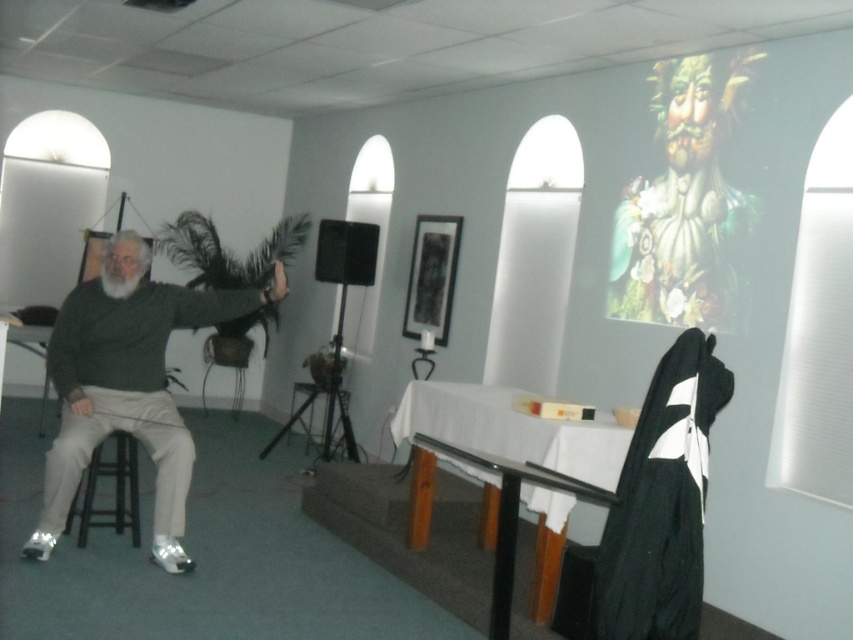
You are standing in the performance room and need to locate the black matte robe at right. Based on the coordinates given, where would you find it?

The black matte robe at right is located at the coordinates point (662, 500).

You are a photographer setting up for a photoshoot. You need to position a light source so that it illuminates the matte green sweater at left without casting a shadow on the black glass table at center. Is this possible based on the current setup?

The matte green sweater at left is above the black glass table at center, so positioning the light source directly above the sweater would illuminate it while avoiding casting a shadow on the table below.

You are planning to place a rectangular box that is 1.2 meters wide on the black glass table at center. Considering the wooden stool at left is positioned next to it, will the box fit on the table without overhanging the edges?

A: The black glass table at center has a width larger than the wooden stool at left. Since the box is 1.2 meters wide, and the table is wider than the stool, it is likely that the table can accommodate the box without overhanging, provided the table is sufficiently wide. However, without exact measurements, we can only confirm the table is wider than the stool, but not the exact dimensions.